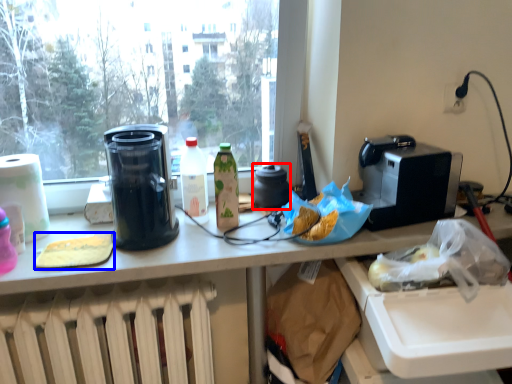
Question: Among these objects, which one is nearest to the camera, appliance (highlighted by a red box) or food (highlighted by a blue box)?

Choices:
 (A) appliance
 (B) food

Answer: (B)